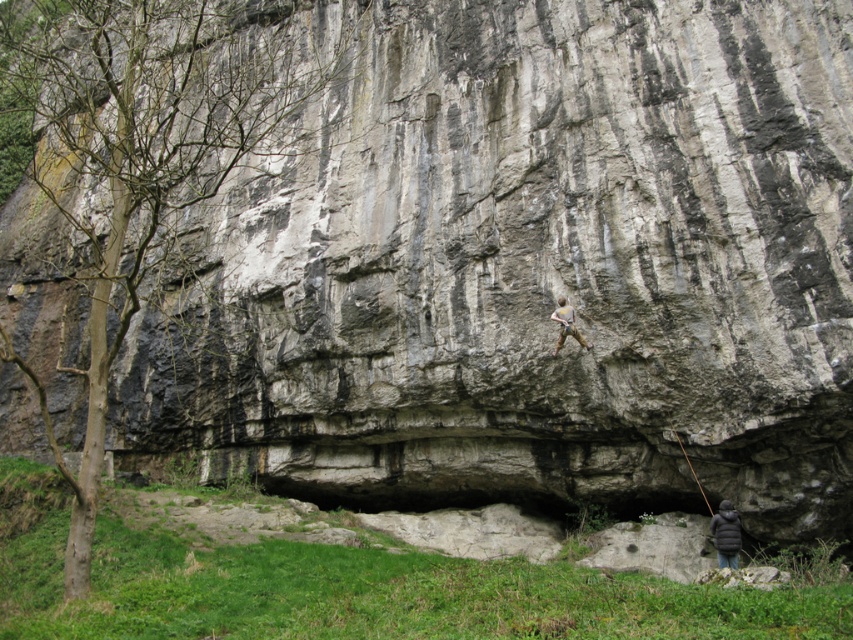
Question: Can you confirm if dark gray puffy jacket at lower right is positioned to the left of camouflage pants at center?

Choices:
 (A) yes
 (B) no

Answer: (B)

Question: Which object is closer to the camera taking this photo?

Choices:
 (A) camouflage pants at center
 (B) dark gray puffy jacket at lower right
 (C) bare wood tree at left

Answer: (C)

Question: Considering the relative positions of bare wood tree at left and dark gray puffy jacket at lower right in the image provided, where is bare wood tree at left located with respect to dark gray puffy jacket at lower right?

Choices:
 (A) left
 (B) right

Answer: (A)

Question: Is bare wood tree at left positioned behind dark gray puffy jacket at lower right?

Choices:
 (A) yes
 (B) no

Answer: (B)

Question: Which point is farther from the camera taking this photo?

Choices:
 (A) (724, 516)
 (B) (567, 310)
 (C) (250, 28)

Answer: (C)

Question: Which point appears closest to the camera in this image?

Choices:
 (A) (567, 321)
 (B) (729, 564)
 (C) (144, 241)

Answer: (C)